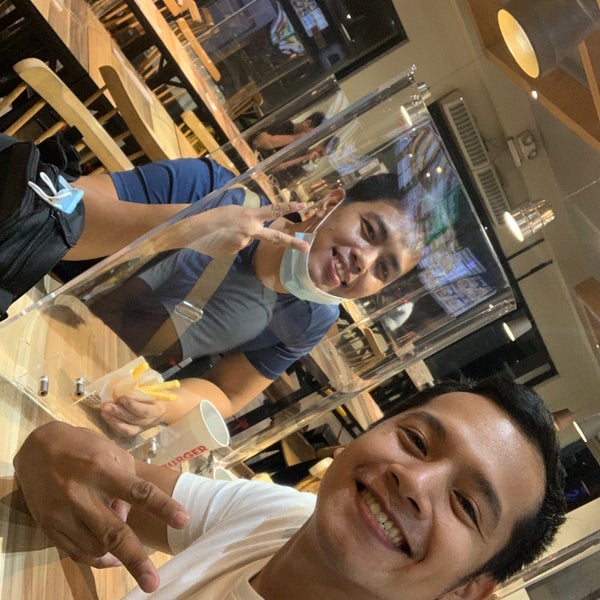
I want to click on cup, so click(x=195, y=432).